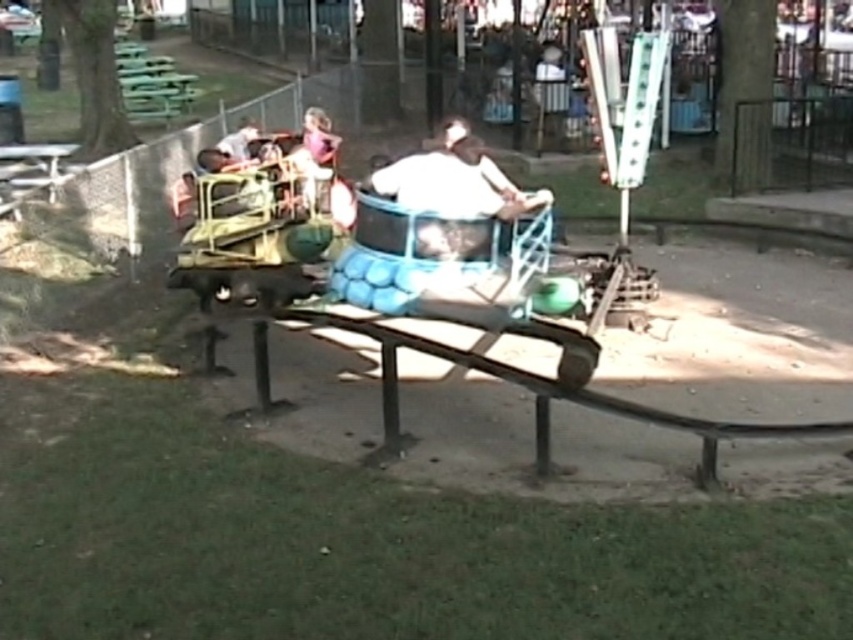
You are a photographer trying to capture the white matte shirt at center in the park scene. Where should you position your camera to ensure the shirt is centered in your shot?

Position your camera at point [456,180] to center the white matte shirt at center in your shot.

You are a photographer at the park and want to take a photo of both the white matte shirt at center and the matte purple shirt at center. Which shirt will appear larger in the photo?

The white matte shirt at center will appear larger in the photo because it is much taller than the matte purple shirt at center.

You are organizing a photo shoot and need to position two models wearing the white matte shirt at center and the matte purple shirt at center. Based on the scene description, which model should stand closer to the small amusement ride to ensure their shirts are clearly visible in the photo?

The white matte shirt at center might be wider than the matte purple shirt at center, so positioning the model in the white matte shirt at center closer to the amusement ride would help ensure their shirt is more visible due to its potentially larger width.